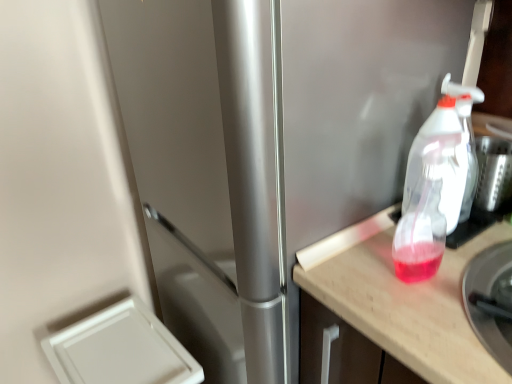
Question: Is white plastic drawer at lower left, which is counted as the second appliance, starting from the right, taller or shorter than translucent plastic spray bottle at right?

Choices:
 (A) tall
 (B) short

Answer: (A)

Question: Considering the relative positions of white plastic drawer at lower left, which is counted as the second appliance, starting from the right, and translucent plastic spray bottle at right in the image provided, is white plastic drawer at lower left, which is counted as the second appliance, starting from the right, to the left or to the right of translucent plastic spray bottle at right?

Choices:
 (A) left
 (B) right

Answer: (A)

Question: Estimate the real-world distances between objects in this image. Which object is farther from the translucent plastic spray bottle at right?

Choices:
 (A) metallic silver bowl at right, which appears as the first appliance when viewed from the right
 (B) white plastic drawer at lower left, acting as the first appliance starting from the back
 (C) transparent plastic spray bottle at right
 (D) wooden countertop at right

Answer: (B)

Question: Estimate the real-world distances between objects in this image. Which object is farther from the wooden countertop at right?

Choices:
 (A) metallic silver bowl at right, which is counted as the 2th appliance, starting from the bottom
 (B) translucent plastic spray bottle at right
 (C) white plastic drawer at lower left, arranged as the 1th appliance when viewed from the left
 (D) transparent plastic spray bottle at right

Answer: (C)